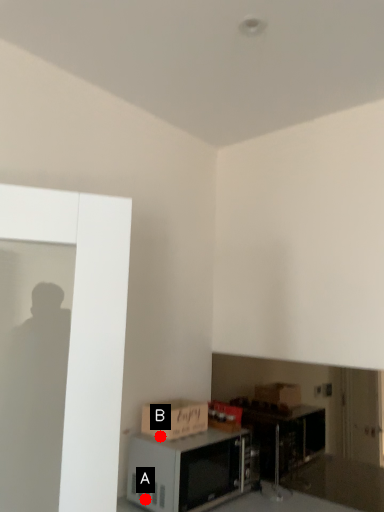
Question: Two points are circled on the image, labeled by A and B beside each circle. Which point is further to the camera?

Choices:
 (A) A is further
 (B) B is further

Answer: (B)